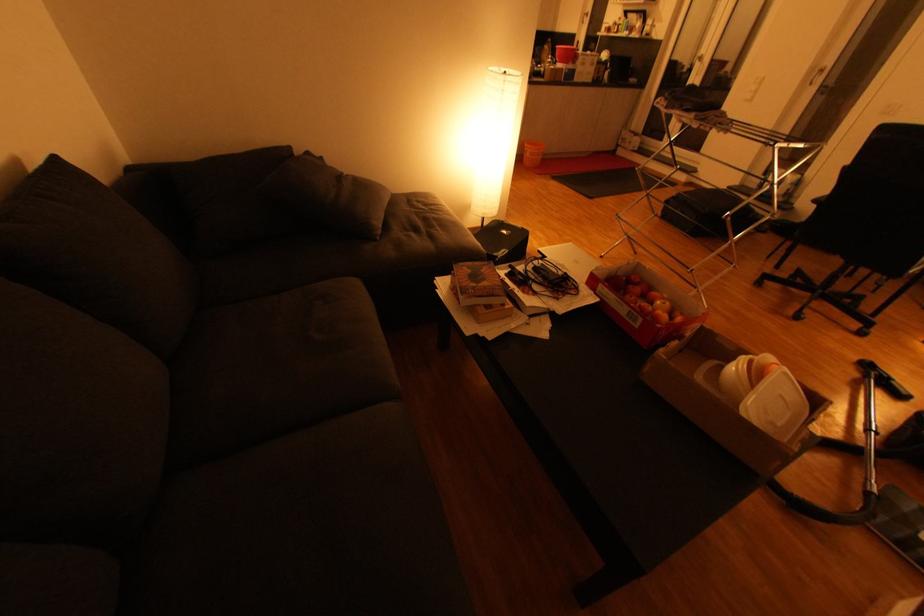
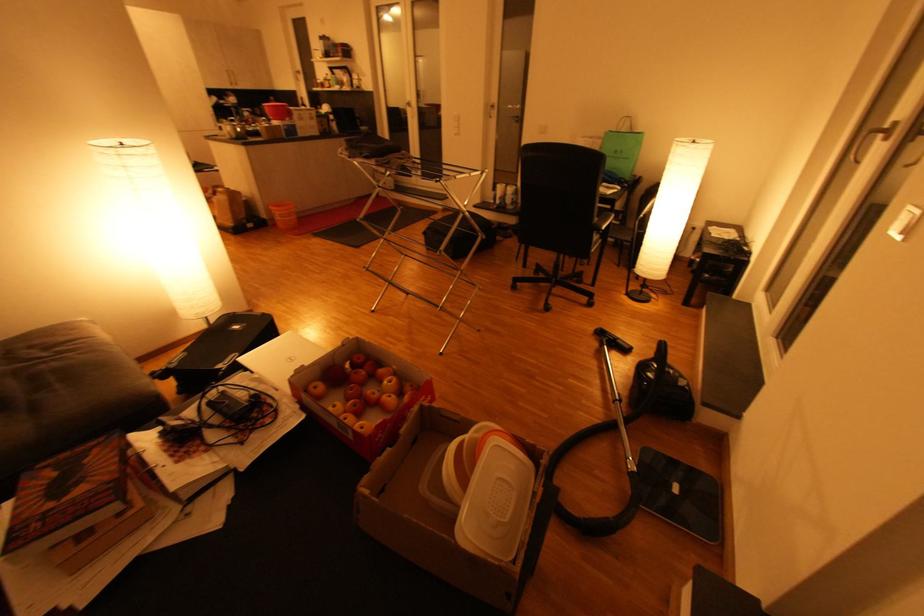
Locate, in the second image, the point that corresponds to point (509, 252) in the first image.

(238, 357)